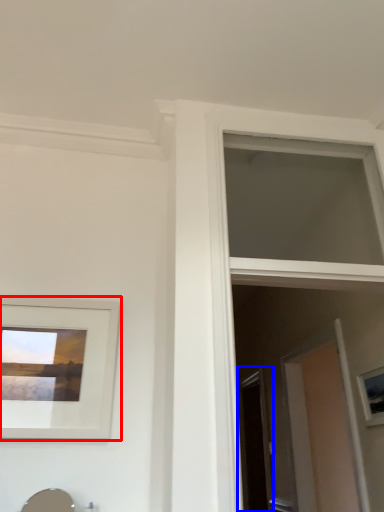
Question: Which object is closer to the camera taking this photo, picture frame (highlighted by a red box) or screen door (highlighted by a blue box)?

Choices:
 (A) picture frame
 (B) screen door

Answer: (A)